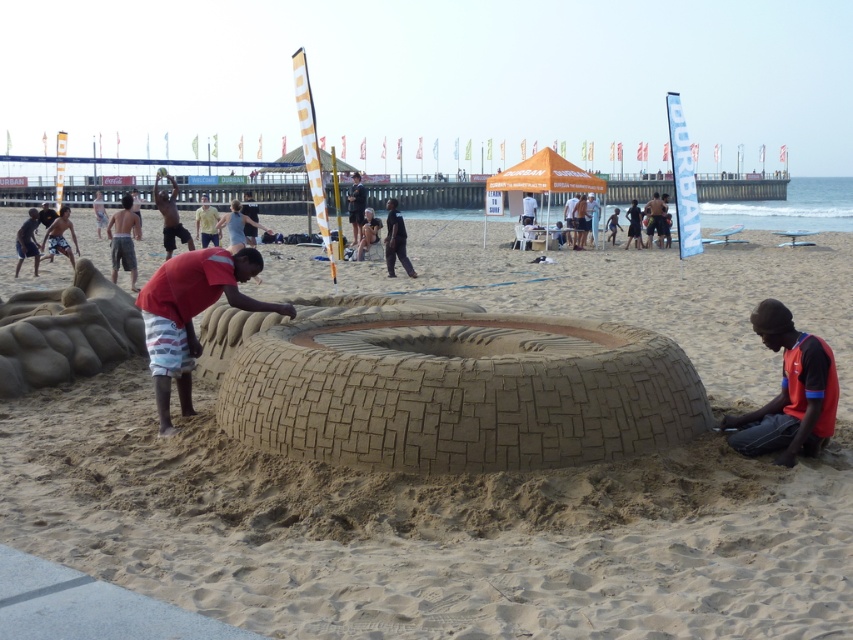
Question: Is brown sand sculpture at center smaller than white shirt at center?

Choices:
 (A) no
 (B) yes

Answer: (A)

Question: Which point appears closest to the camera in this image?

Choices:
 (A) [x=347, y=211]
 (B) [x=111, y=236]
 (C) [x=196, y=211]
 (D) [x=248, y=266]

Answer: (D)

Question: Is dark skin human at center smaller than dark red shirt at center?

Choices:
 (A) yes
 (B) no

Answer: (A)

Question: Is brown sand sculpture at center closer to camera compared to light yellow fabric shirt at center?

Choices:
 (A) no
 (B) yes

Answer: (B)

Question: Which point is closer to the camera taking this photo?

Choices:
 (A) (166, 237)
 (B) (212, 234)
 (C) (785, 394)
 (D) (619, 620)

Answer: (D)

Question: Which object appears closest to the camera in this image?

Choices:
 (A) dark red shirt at center
 (B) brown sand sculpture at center
 (C) orange fabric at lower right

Answer: (B)